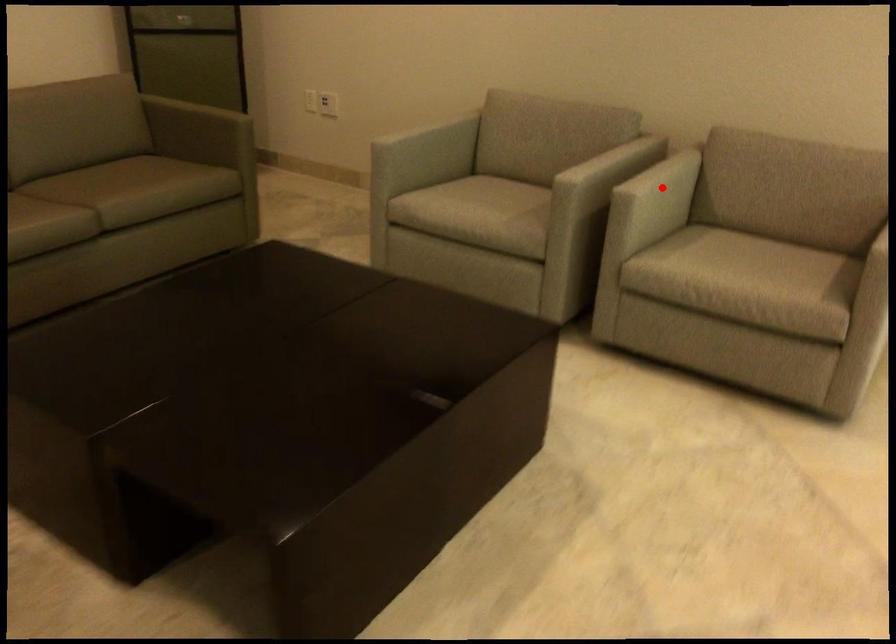
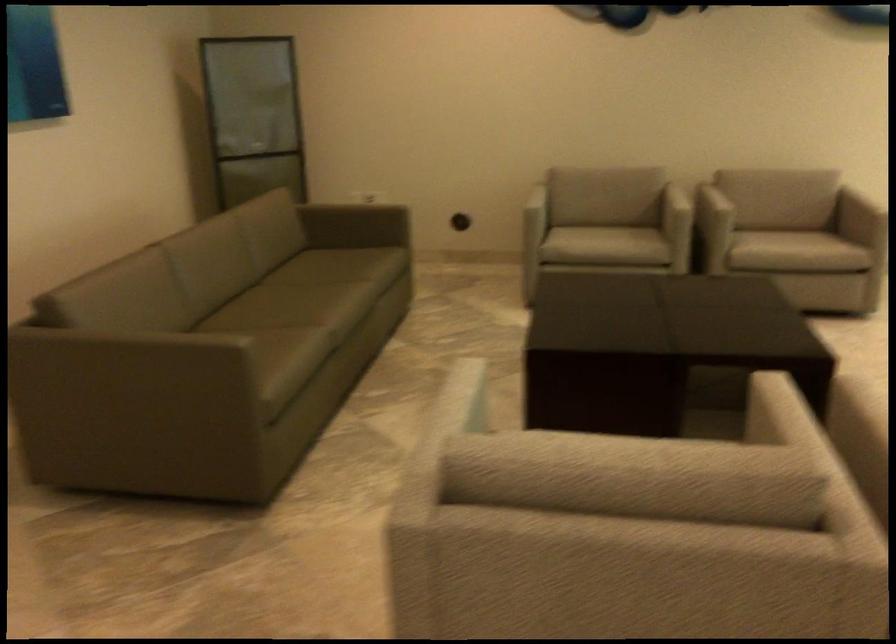
Question: I am providing you with two images of the same scene from different viewpoints. A red point is shown in image1. For the corresponding object point in image2, is it positioned nearer or farther from the camera?

Choices:
 (A) Nearer
 (B) Farther

Answer: (B)